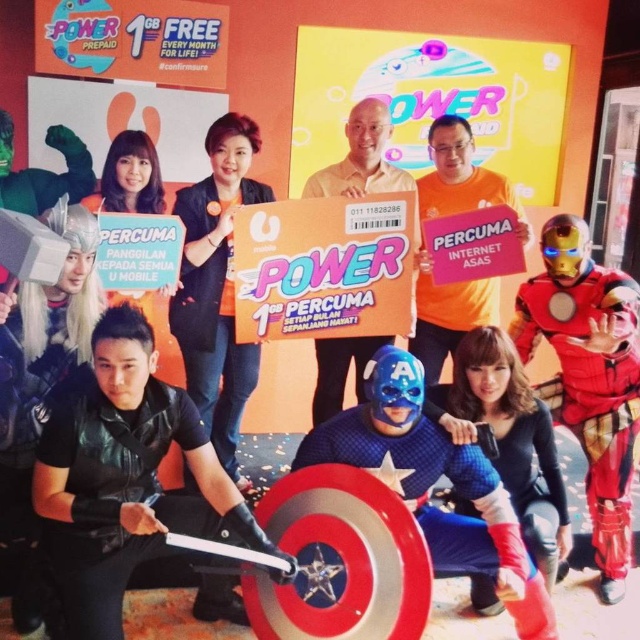
You are a photographer at the event and need to adjust the lighting so that the orange matte shirt at center and the matte cardboard box at center are both well lit. Since the shirt is to the right of the box, which side should you position the light to ensure both are illuminated evenly?

Since the orange matte shirt at center is to the right of the matte cardboard box at center, positioning the light to the left of both objects will ensure even illumination.